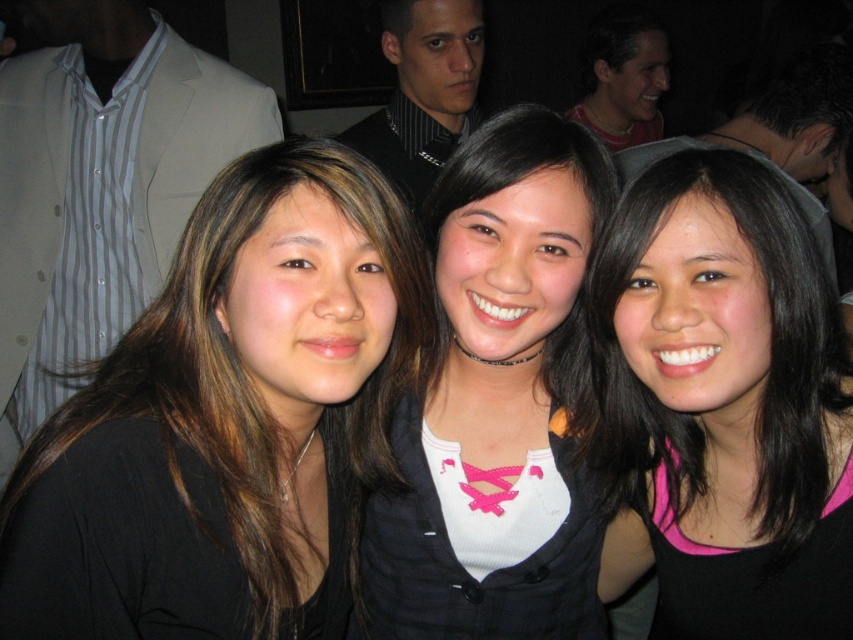
Question: Is pink matte tank top at center thinner than matte black shirt at upper center?

Choices:
 (A) yes
 (B) no

Answer: (A)

Question: Does black matte hair at left have a lesser width compared to pink matte tank top at center?

Choices:
 (A) no
 (B) yes

Answer: (A)

Question: Which is nearer to the dark brown hair at left?

Choices:
 (A) matte black shirt at upper center
 (B) pink matte tank top at center
 (C) pink lace-up shirt at center

Answer: (A)

Question: Which point is farther to the camera?

Choices:
 (A) dark brown hair at left
 (B) pink matte tank top at center

Answer: (A)

Question: Considering the real-world distances, which object is closest to the black matte hair at left?

Choices:
 (A) dark brown hair at left
 (B) pink matte tank top at center

Answer: (B)

Question: Is black matte hair at left to the right of dark brown hair at left from the viewer's perspective?

Choices:
 (A) yes
 (B) no

Answer: (A)